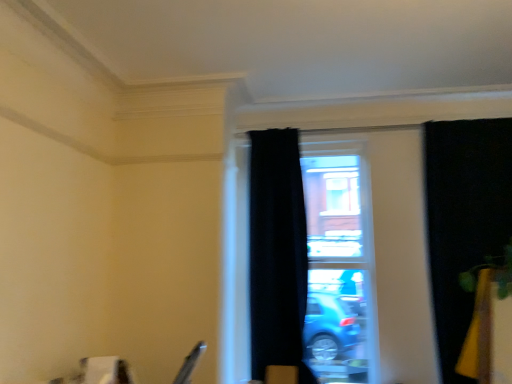
Question: Does black velvet curtain at right, which is the 2th curtain in left-to-right order, have a lesser height compared to black velvet curtain at center, which is the 2th curtain in right-to-left order?

Choices:
 (A) no
 (B) yes

Answer: (B)

Question: Could you tell me if black velvet curtain at right, which is the 2th curtain in left-to-right order, is turned towards black velvet curtain at center, which is the 2th curtain in right-to-left order?

Choices:
 (A) yes
 (B) no

Answer: (B)

Question: Is black velvet curtain at right, which is the 2th curtain in left-to-right order, completely or partially outside of black velvet curtain at center, which is the 2th curtain in right-to-left order?

Choices:
 (A) yes
 (B) no

Answer: (A)

Question: Can you confirm if black velvet curtain at right, which is the 2th curtain in left-to-right order, is bigger than black velvet curtain at center, which is the 2th curtain in right-to-left order?

Choices:
 (A) yes
 (B) no

Answer: (A)

Question: Considering the relative positions of black velvet curtain at right, which is the 1th curtain in right-to-left order, and black velvet curtain at center, which is the 2th curtain in right-to-left order, in the image provided, is black velvet curtain at right, which is the 1th curtain in right-to-left order, in front of black velvet curtain at center, which is the 2th curtain in right-to-left order,?

Choices:
 (A) no
 (B) yes

Answer: (B)

Question: From a real-world perspective, is transparent glass window at center physically located above or below black velvet curtain at center, arranged as the 1th curtain when viewed from the left?

Choices:
 (A) above
 (B) below

Answer: (B)

Question: Is transparent glass window at center taller or shorter than black velvet curtain at center, arranged as the 1th curtain when viewed from the left?

Choices:
 (A) tall
 (B) short

Answer: (B)

Question: Is transparent glass window at center inside or outside of black velvet curtain at center, which is the 2th curtain in right-to-left order?

Choices:
 (A) inside
 (B) outside

Answer: (B)

Question: Considering the positions of point (234, 334) and point (292, 153), is point (234, 334) closer or farther from the camera than point (292, 153)?

Choices:
 (A) farther
 (B) closer

Answer: (B)

Question: From a real-world perspective, is black velvet curtain at center, which is the 2th curtain in right-to-left order, physically located above or below black velvet curtain at right, which is the 2th curtain in left-to-right order?

Choices:
 (A) above
 (B) below

Answer: (B)

Question: Do you think black velvet curtain at center, which is the 2th curtain in right-to-left order, is within black velvet curtain at right, which is the 1th curtain in right-to-left order, or outside of it?

Choices:
 (A) outside
 (B) inside

Answer: (A)

Question: Relative to black velvet curtain at right, which is the 1th curtain in right-to-left order, is black velvet curtain at center, arranged as the 1th curtain when viewed from the left, in front or behind?

Choices:
 (A) front
 (B) behind

Answer: (B)

Question: From the image's perspective, is black velvet curtain at center, which is the 2th curtain in right-to-left order, positioned above or below black velvet curtain at right, which is the 2th curtain in left-to-right order?

Choices:
 (A) below
 (B) above

Answer: (A)

Question: Relative to transparent glass window at center, is black velvet curtain at center, arranged as the 1th curtain when viewed from the left, in front or behind?

Choices:
 (A) behind
 (B) front

Answer: (B)

Question: Looking at their shapes, would you say black velvet curtain at center, which is the 2th curtain in right-to-left order, is wider or thinner than transparent glass window at center?

Choices:
 (A) wide
 (B) thin

Answer: (A)